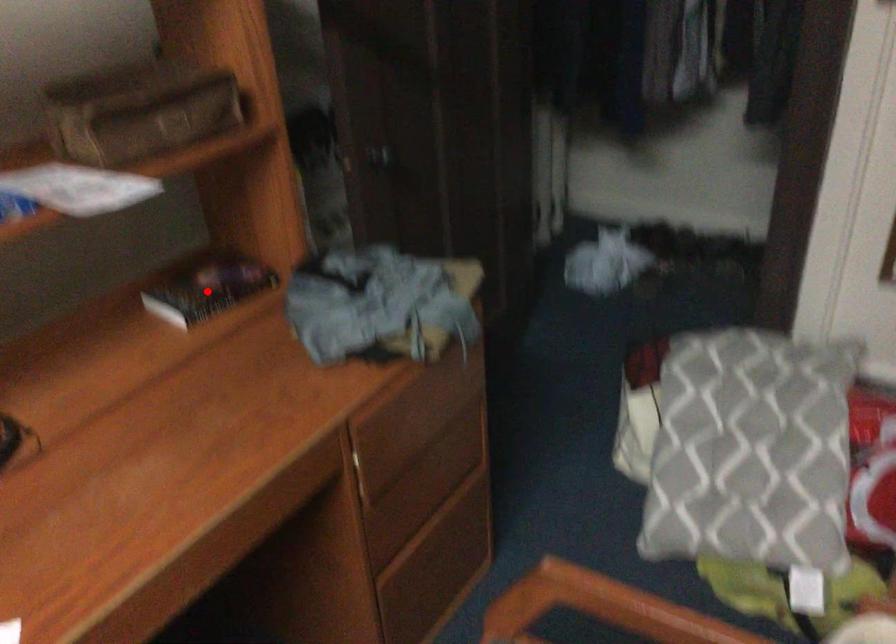
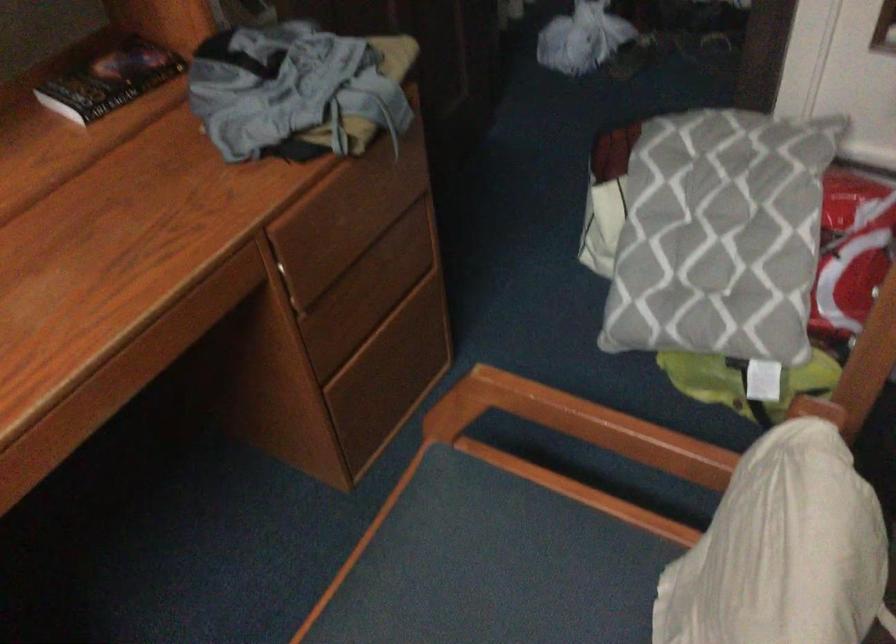
In the second image, find the point that corresponds to the highlighted location in the first image.

(110, 80)